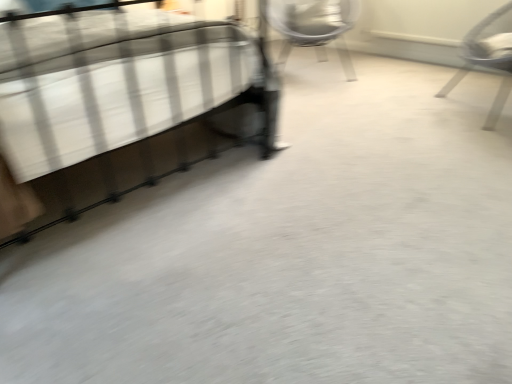
Where is `vacant space underneath metallic silver chair at upper center, which appears as the first chair when viewed from the left (from a real-world perspective)`? Image resolution: width=512 pixels, height=384 pixels. vacant space underneath metallic silver chair at upper center, which appears as the first chair when viewed from the left (from a real-world perspective) is located at coordinates (306, 65).